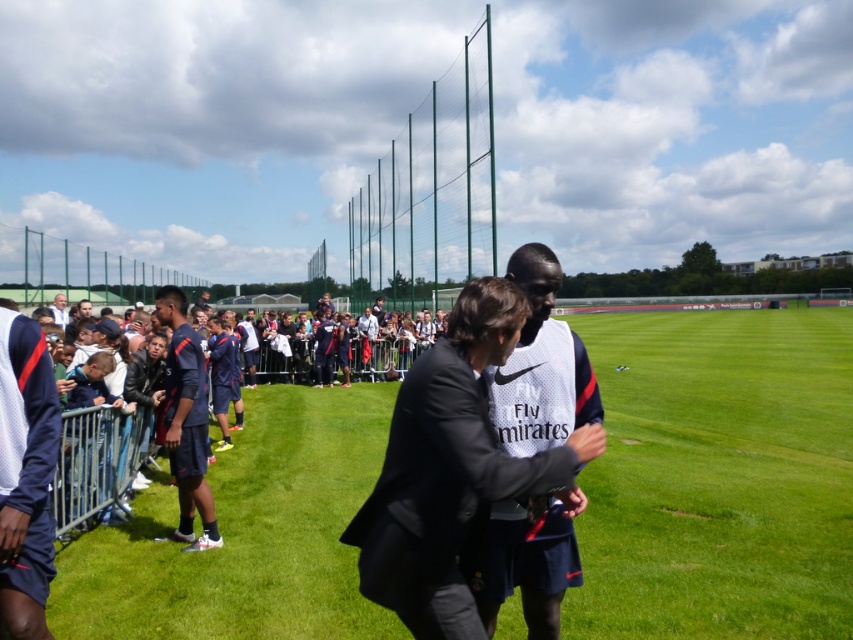
Who is taller, white mesh jersey at center or white fabric shirt at upper left?

With more height is white mesh jersey at center.

Who is higher up, white mesh jersey at center or white fabric shirt at upper left?

white fabric shirt at upper left

Does point (566, 564) come behind point (62, 310)?

No, (566, 564) is closer to viewer.

I want to click on white mesh jersey at center, so click(541, 365).

Between green grass at center and white fabric shirt at upper left, which one is positioned lower?

green grass at center

Is green grass at center in front of white fabric shirt at upper left?

Yes, green grass at center is closer to the viewer.

Is point (671, 436) closer to viewer compared to point (51, 300)?

Yes, it is in front of point (51, 300).

Identify the location of green grass at center. Image resolution: width=853 pixels, height=640 pixels. (718, 476).

Can you confirm if green grass at center is wider than white matte jersey at left?

Correct, the width of green grass at center exceeds that of white matte jersey at left.

Does point (657, 563) lie in front of point (36, 467)?

That is False.

Image resolution: width=853 pixels, height=640 pixels. What do you see at coordinates (718, 476) in the screenshot?
I see `green grass at center` at bounding box center [718, 476].

Identify the location of green grass at center. (718, 476).